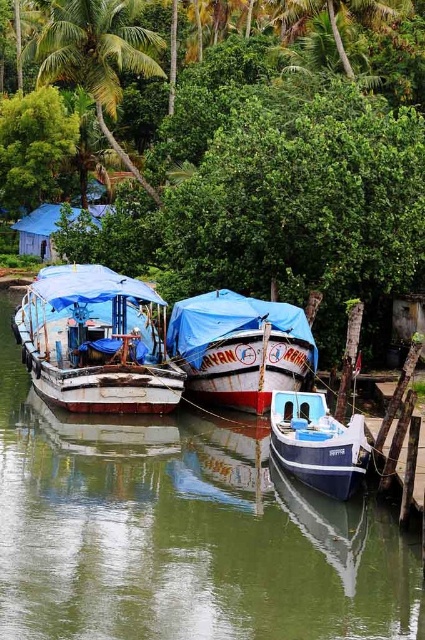
Between green leafy tree at upper center and blue tarpaulin hut at upper left, which one appears on the right side from the viewer's perspective?

From the viewer's perspective, green leafy tree at upper center appears more on the right side.

Does green leafy tree at upper center have a greater height compared to blue tarpaulin hut at upper left?

Yes.

The image size is (425, 640). I want to click on green leafy tree at upper center, so click(277, 193).

You are a GUI agent. You are given a task and a screenshot of the screen. Output one action in this format:
    pyautogui.click(x=<x>, y=<y>)
    Task: Click on the green leafy tree at upper center
    The image size is (425, 640).
    Given the screenshot: What is the action you would take?
    pyautogui.click(x=277, y=193)

Which is below, rusty metal boat at left or blue tarpaulin hut at upper left?

rusty metal boat at left is below.

Who is taller, rusty metal boat at left or blue tarpaulin hut at upper left?

rusty metal boat at left is taller.

Is point (79, 356) positioned in front of point (50, 250)?

That is True.

The height and width of the screenshot is (640, 425). What are the coordinates of `rusty metal boat at left` in the screenshot? It's located at (96, 340).

Does white wooden boat at center have a smaller size compared to green leafy palm tree at upper left?

Yes.

Measure the distance between point (184, 346) and camera.

Point (184, 346) and camera are 28.19 meters apart from each other.

Does point (308, 326) come farther from viewer compared to point (141, 176)?

No, (308, 326) is in front of (141, 176).

Locate an element on the screen. Image resolution: width=425 pixels, height=640 pixels. white wooden boat at center is located at coordinates (240, 348).